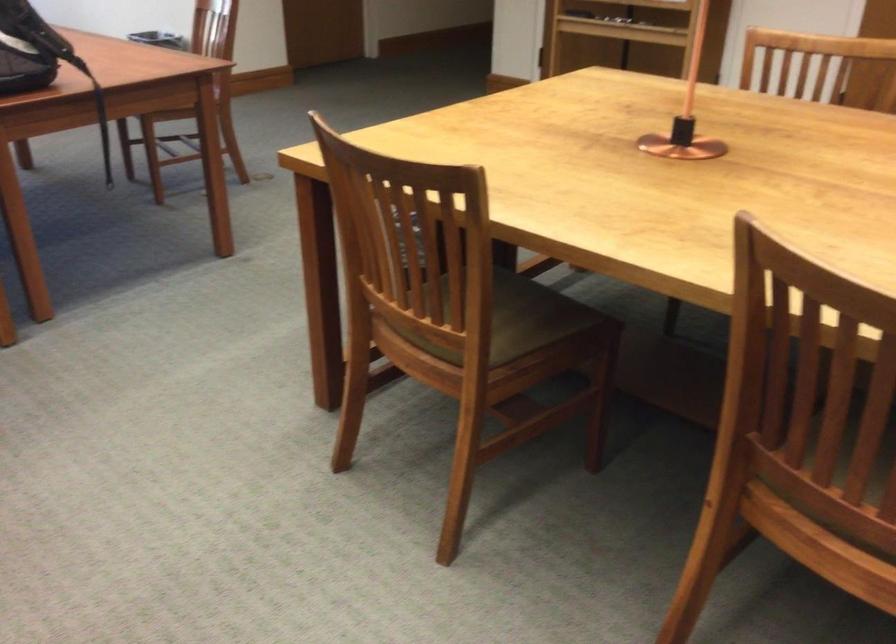
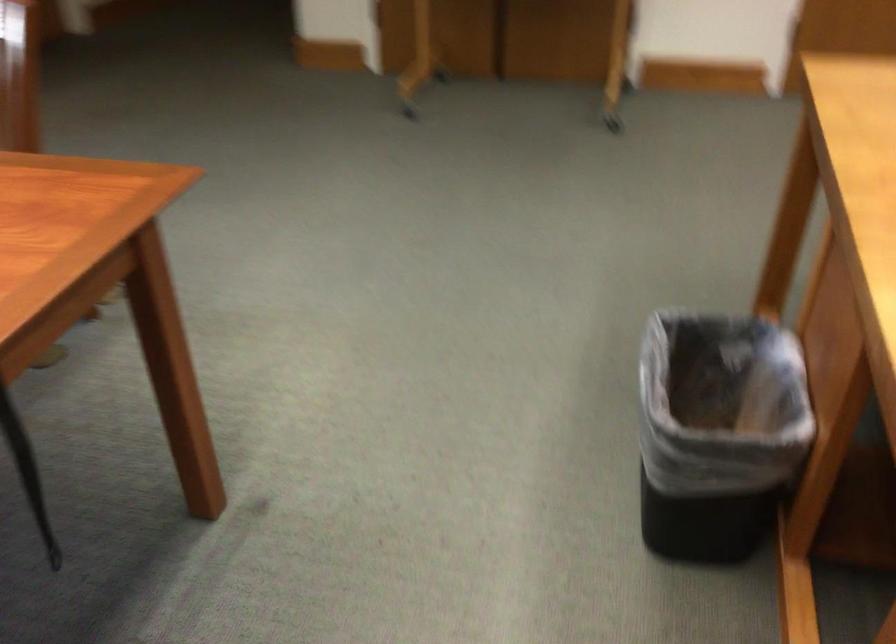
The images are taken continuously from a first-person perspective. In which direction are you moving?

The cameraman walked toward left, forward.